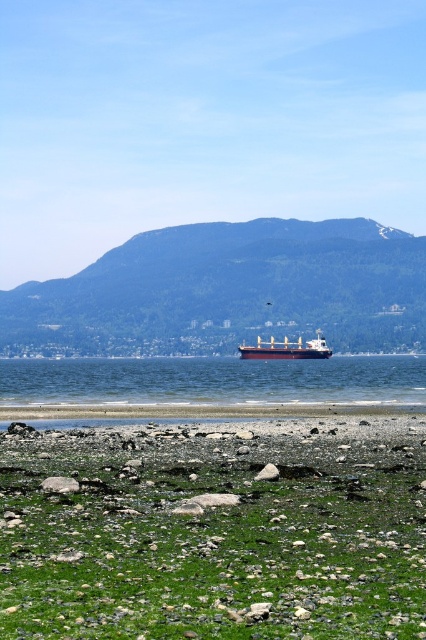
You are standing on the rocky beach and want to take a photo of both the green mossy rocks at lower center and the green forested mountain at center. Which object should you focus on first to ensure both are in the frame?

You should focus on the green mossy rocks at lower center first since it is closer to you than the green forested mountain at center, allowing both to be in the frame when properly adjusted.